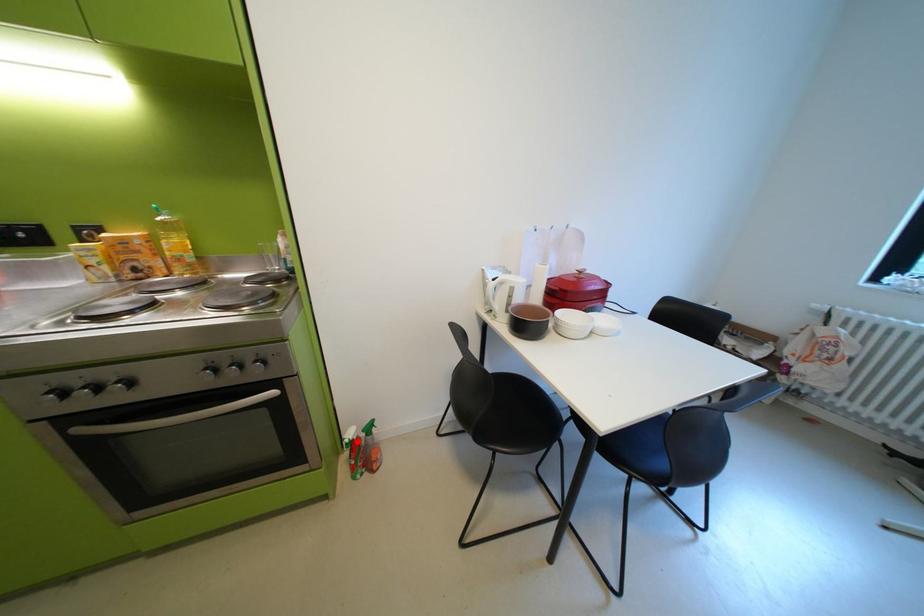
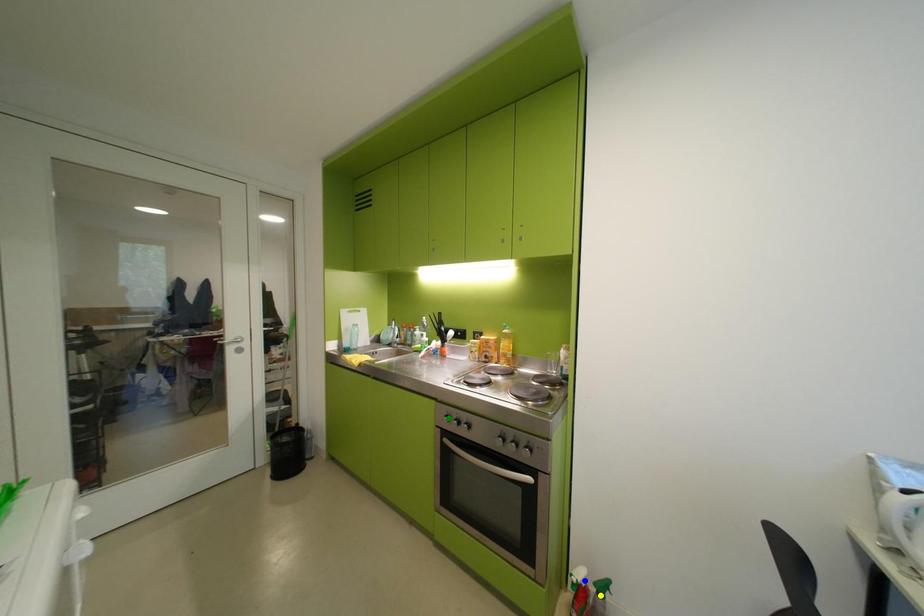
Question: I am providing you with two images of the same scene from different viewpoints. A red point is marked on the first image. You are given multiple points on the second image. Which point in image 2 is actually the same real-world point as the red point in image 1?

Choices:
 (A) yellow point
 (B) green point
 (C) blue point

Answer: (C)